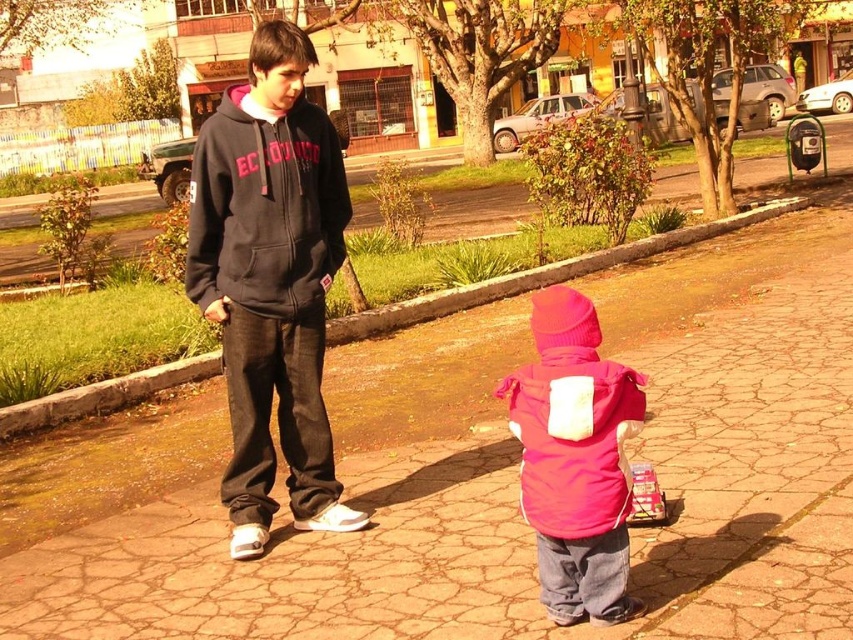
Question: Estimate the real-world distances between objects in this image. Which object is farther from the dark gray fleece hoodie at center?

Choices:
 (A) matte black hoodie at center
 (B) brown stone pavement at center

Answer: (B)

Question: Among these points, which one is nearest to the camera?

Choices:
 (A) (279, 268)
 (B) (303, 131)
 (C) (689, 372)

Answer: (A)

Question: Does brown stone pavement at center have a larger size compared to dark gray fleece hoodie at center?

Choices:
 (A) yes
 (B) no

Answer: (A)

Question: Which object appears farthest from the camera in this image?

Choices:
 (A) brown stone pavement at center
 (B) pink fleece jacket at center

Answer: (B)

Question: Is pink fleece jacket at center thinner than dark gray fleece hoodie at center?

Choices:
 (A) no
 (B) yes

Answer: (B)

Question: Does brown stone pavement at center appear on the left side of matte black hoodie at center?

Choices:
 (A) no
 (B) yes

Answer: (A)